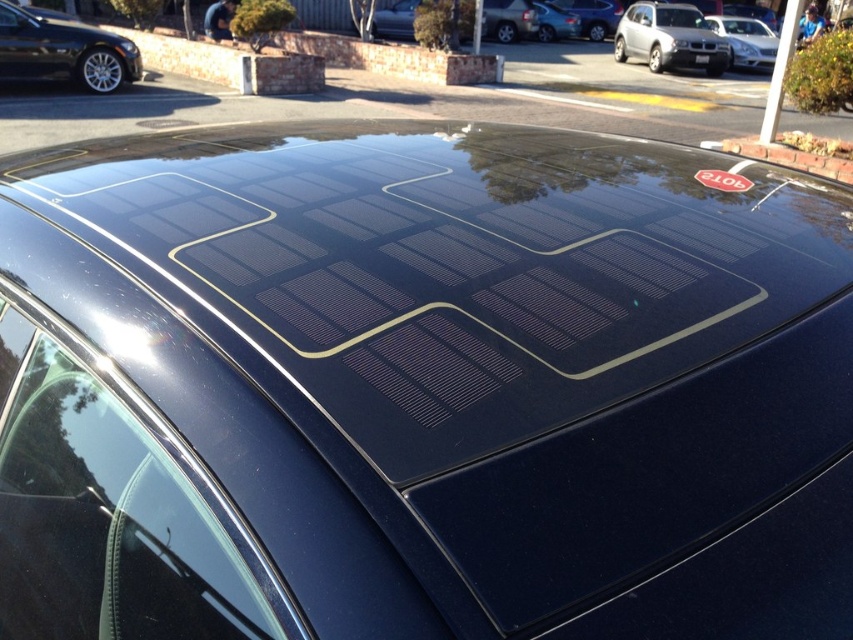
Question: Is satin silver suv at upper right to the left of satin silver sedan at upper right from the viewer's perspective?

Choices:
 (A) yes
 (B) no

Answer: (A)

Question: From the image, what is the correct spatial relationship of transparent glass windshield at lower left in relation to satin silver suv at upper right?

Choices:
 (A) below
 (B) above

Answer: (A)

Question: Which point is closer to the camera?

Choices:
 (A) (675, 24)
 (B) (83, 49)
 (C) (734, 40)
 (D) (90, 509)

Answer: (D)

Question: Does transparent glass windshield at lower left lie in front of satin silver suv at upper right?

Choices:
 (A) no
 (B) yes

Answer: (B)

Question: Which object is the closest to the glossy black solar panel at upper center?

Choices:
 (A) transparent glass windshield at lower left
 (B) satin silver sedan at upper right
 (C) satin silver suv at upper right
 (D) glossy black car at upper left

Answer: (C)

Question: Which object appears farthest from the camera in this image?

Choices:
 (A) glossy black car at upper left
 (B) glossy black solar panel at upper center
 (C) satin silver sedan at upper right
 (D) satin silver suv at upper right

Answer: (C)